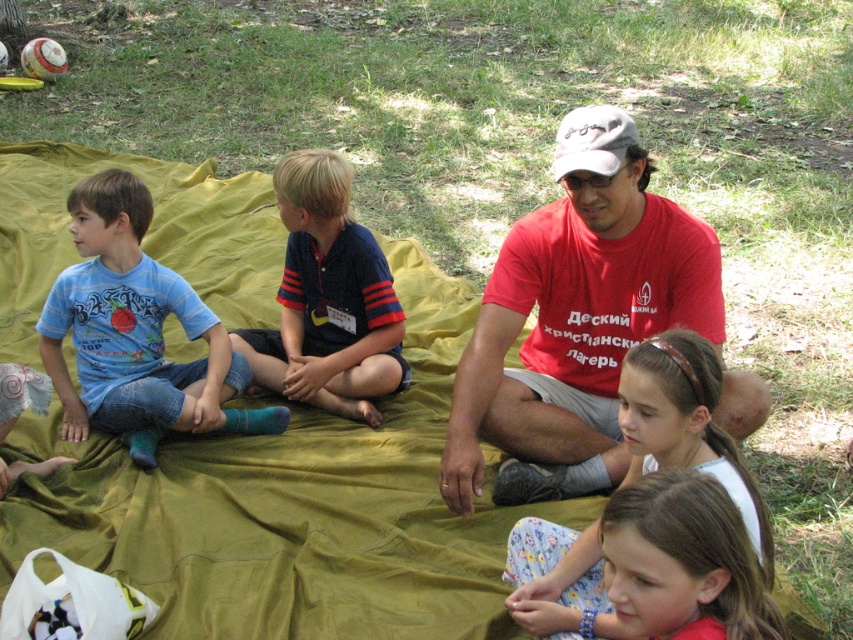
You are a photographer trying to capture a candid shot of the children on the green tarp. You want to ensure that the blue denim jeans at left are visible in the frame. Based on their position, where should you position your camera relative to the group?

The blue denim jeans at left are located at point (136, 332), so positioning the camera slightly to the left and lower than the center of the group would ensure they are visible in the frame.

You are a photographer trying to capture a candid shot of the red cotton shirt at center and the gray fabric baseball cap at center. Since you want both items to appear clearly in the frame, which one should you focus on first to ensure sharpness?

The red cotton shirt at center has a larger size compared to the gray fabric baseball cap at center, so you should focus on the red cotton shirt at center first to ensure it appears sharp in the photo.

You are a photographer setting up a shot of the scene described. You want to ensure both the blue striped polo shirt at center and the floral fabric pants at lower center are clearly visible. Which object should you focus on first to ensure proper focus, considering their sizes?

The blue striped polo shirt at center is smaller than the floral fabric pants at lower center, so you should focus on the blue striped polo shirt at center first since smaller objects may require more precise focusing to capture details clearly.